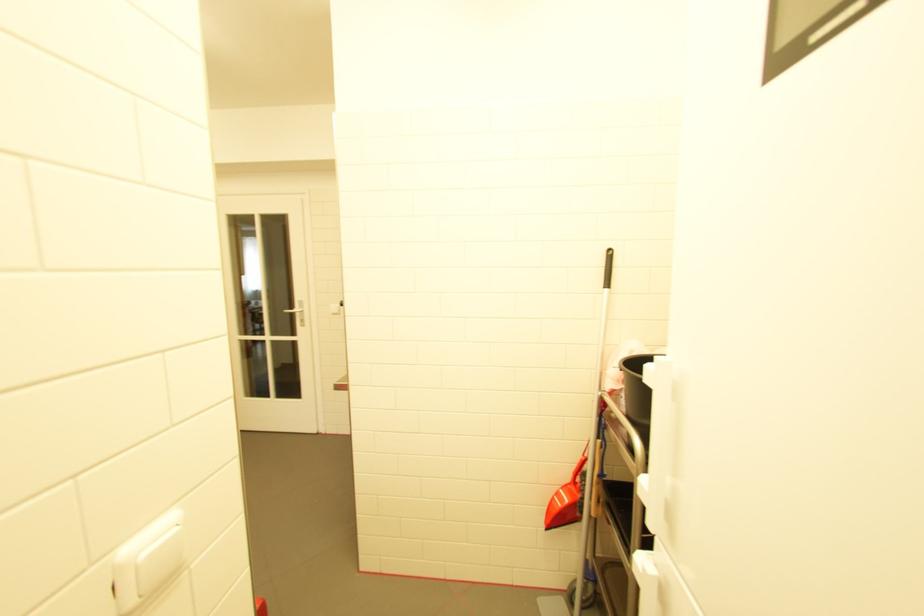
Find the location of a particular element. black bucket is located at coordinates (636, 387).